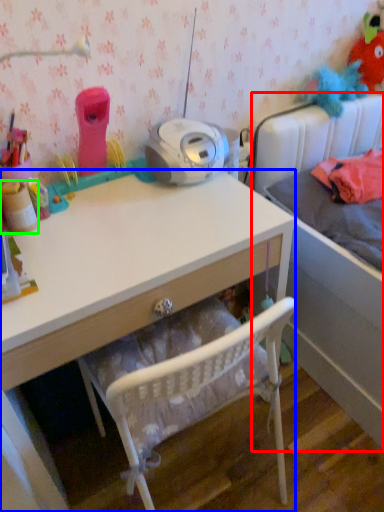
Question: Which object is the farthest from bed (highlighted by a red box)? Choose among these: desk (highlighted by a blue box) or toy (highlighted by a green box).

Choices:
 (A) desk
 (B) toy

Answer: (B)